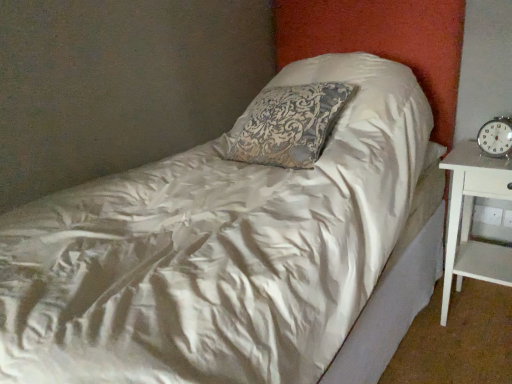
Measure the distance between point [494,131] and camera.

They are 1.56 meters apart.

The height and width of the screenshot is (384, 512). Describe the element at coordinates (496, 137) in the screenshot. I see `metallic silver clock at right` at that location.

Find the location of a particular element. Image resolution: width=512 pixels, height=384 pixels. metallic silver clock at right is located at coordinates (496, 137).

Find the location of a particular element. This screenshot has width=512, height=384. white wood nightstand at right is located at coordinates (471, 219).

Measure the distance between point (x=444, y=306) and camera.

Point (x=444, y=306) is 1.79 meters from camera.

The height and width of the screenshot is (384, 512). Describe the element at coordinates (471, 219) in the screenshot. I see `white wood nightstand at right` at that location.

What is the approximate width of white wood nightstand at right?

14.88 inches.

This screenshot has width=512, height=384. Identify the location of metallic silver clock at right. (496, 137).

Is white wood nightstand at right at the right side of metallic silver clock at right?

Yes, white wood nightstand at right is to the right of metallic silver clock at right.

Considering the positions of objects white wood nightstand at right and metallic silver clock at right in the image provided, who is in front, white wood nightstand at right or metallic silver clock at right?

white wood nightstand at right.

Between point (466, 191) and point (484, 130), which one is positioned in front?

Positioned in front is point (466, 191).

From the image's perspective, which is below, white wood nightstand at right or metallic silver clock at right?

From the image's view, white wood nightstand at right is below.

From a real-world perspective, is white wood nightstand at right positioned above or below metallic silver clock at right?

white wood nightstand at right is below metallic silver clock at right.

Which object is thinner, white wood nightstand at right or metallic silver clock at right?

metallic silver clock at right is thinner.

Considering the relative sizes of white wood nightstand at right and metallic silver clock at right in the image provided, is white wood nightstand at right taller than metallic silver clock at right?

Indeed, white wood nightstand at right has a greater height compared to metallic silver clock at right.

Between white wood nightstand at right and metallic silver clock at right, which one has smaller size?

With smaller size is metallic silver clock at right.

Is metallic silver clock at right completely or partially inside white wood nightstand at right?

No, metallic silver clock at right is located outside of white wood nightstand at right.

Is white wood nightstand at right positioned far away from metallic silver clock at right?

No, there isn't a large distance between white wood nightstand at right and metallic silver clock at right.

Is white wood nightstand at right positioned with its back to metallic silver clock at right?

No.

Where is `clock to the left of white wood nightstand at right`? The image size is (512, 384). clock to the left of white wood nightstand at right is located at coordinates (496, 137).

Consider the image. Does metallic silver clock at right appear on the left side of white wood nightstand at right?

Indeed, metallic silver clock at right is positioned on the left side of white wood nightstand at right.

Does metallic silver clock at right lie in front of white wood nightstand at right?

No, it is behind white wood nightstand at right.

Does point (489, 132) come in front of point (455, 173)?

That is False.

From the image's perspective, is metallic silver clock at right positioned above or below white wood nightstand at right?

From the image's perspective, metallic silver clock at right appears above white wood nightstand at right.

From a real-world perspective, relative to white wood nightstand at right, is metallic silver clock at right vertically above or below?

Clearly, from a real-world perspective, metallic silver clock at right is above white wood nightstand at right.

Is metallic silver clock at right wider than white wood nightstand at right?

No, metallic silver clock at right is not wider than white wood nightstand at right.

From the picture: Does metallic silver clock at right have a lesser height compared to white wood nightstand at right?

Yes.

Does metallic silver clock at right have a larger size compared to white wood nightstand at right?

No, metallic silver clock at right is not bigger than white wood nightstand at right.

Is metallic silver clock at right positioned beyond the bounds of white wood nightstand at right?

metallic silver clock at right lies outside white wood nightstand at right's area.

Is the surface of metallic silver clock at right in direct contact with white wood nightstand at right?

No, metallic silver clock at right is not beside white wood nightstand at right.

Is metallic silver clock at right facing away from white wood nightstand at right?

That's not correct — metallic silver clock at right is not looking away from white wood nightstand at right.

Can you tell me how much metallic silver clock at right and white wood nightstand at right differ in facing direction?

The angular difference between metallic silver clock at right and white wood nightstand at right is 12 degrees.

You are a GUI agent. You are given a task and a screenshot of the screen. Output one action in this format:
    pyautogui.click(x=<x>, y=<y>)
    Task: Click on the clock behind the white wood nightstand at right
    The width and height of the screenshot is (512, 384).
    Given the screenshot: What is the action you would take?
    pyautogui.click(x=496, y=137)

The width and height of the screenshot is (512, 384). Identify the location of clock on the left of white wood nightstand at right. (496, 137).

Locate an element on the screen. The width and height of the screenshot is (512, 384). nightstand in front of the metallic silver clock at right is located at coordinates (471, 219).